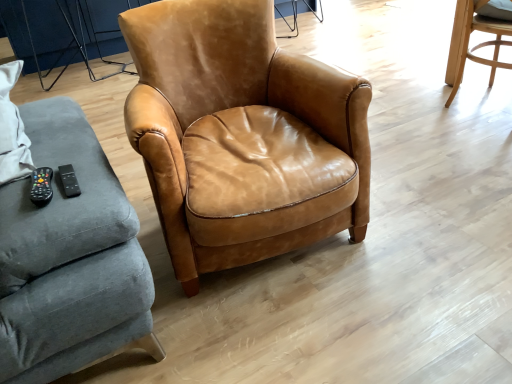
Identify the location of vacant space that's between light brown leather chair at upper right, which appears as the 1th chair when viewed from the right, and cognac leather armchair at center, the 2th chair when ordered from right to left. The image size is (512, 384). click(428, 157).